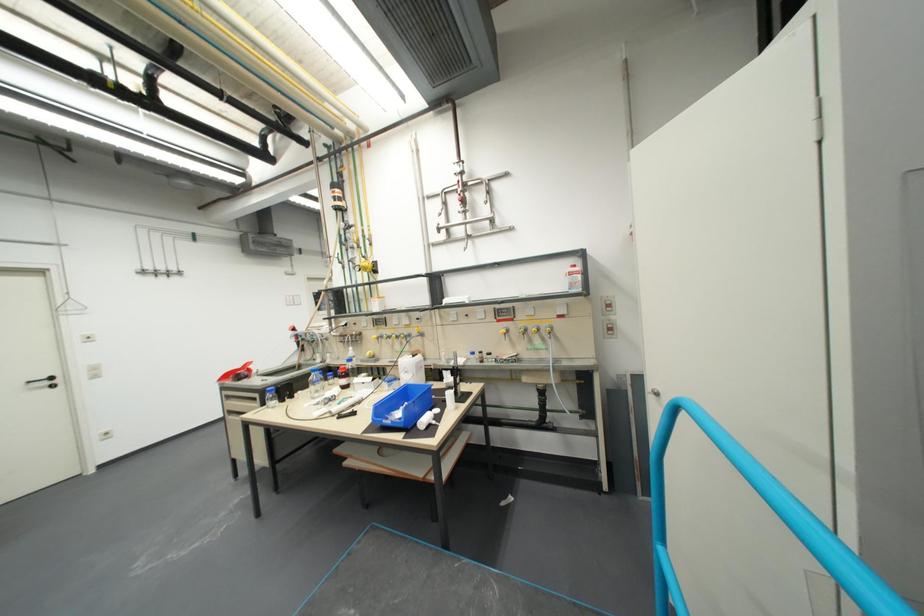
Where would you lift the blue plastic bin? Please return your answer as a coordinate pair (x, y).

(403, 406)